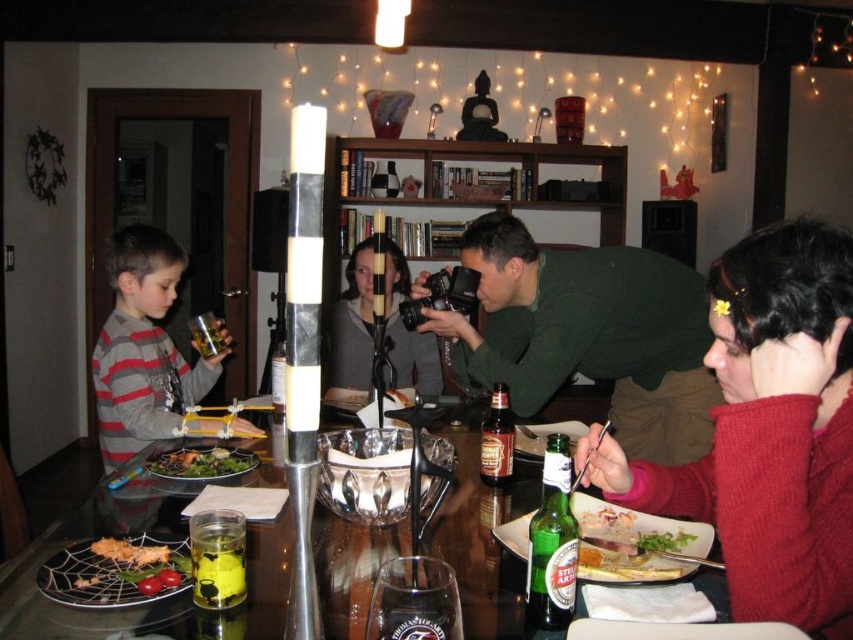
This screenshot has height=640, width=853. What do you see at coordinates (639, 525) in the screenshot? I see `green glass bottle at lower right` at bounding box center [639, 525].

Does green glass bottle at lower right appear on the right side of green leafy salad at lower right?

No, green glass bottle at lower right is not to the right of green leafy salad at lower right.

Locate an element on the screen. green glass bottle at lower right is located at coordinates (639, 525).

This screenshot has width=853, height=640. I want to click on green glass bottle at lower right, so click(639, 525).

Does clear glass bowl at center have a greater height compared to green glass bottle at lower right?

Yes.

Can you confirm if clear glass bowl at center is shorter than green glass bottle at lower right?

No, clear glass bowl at center is not shorter than green glass bottle at lower right.

Does point (367, 524) come closer to viewer compared to point (647, 540)?

No, it is behind (647, 540).

The image size is (853, 640). Find the location of `clear glass bowl at center`. clear glass bowl at center is located at coordinates (364, 474).

Is green matte shirt at center below clear glass bowl at center?

Actually, green matte shirt at center is above clear glass bowl at center.

Is green matte shirt at center to the right of clear glass bowl at center from the viewer's perspective?

Correct, you'll find green matte shirt at center to the right of clear glass bowl at center.

Which is behind, point (502, 260) or point (421, 442)?

Positioned behind is point (502, 260).

In order to click on green matte shirt at center in this screenshot , I will do `click(589, 333)`.